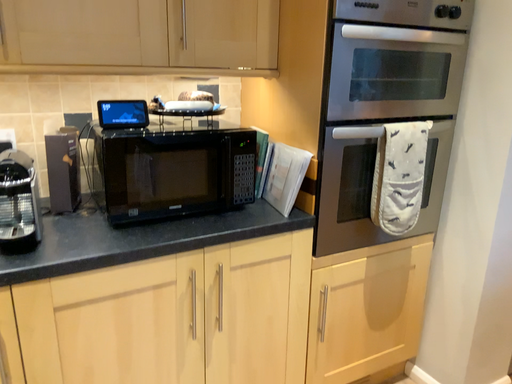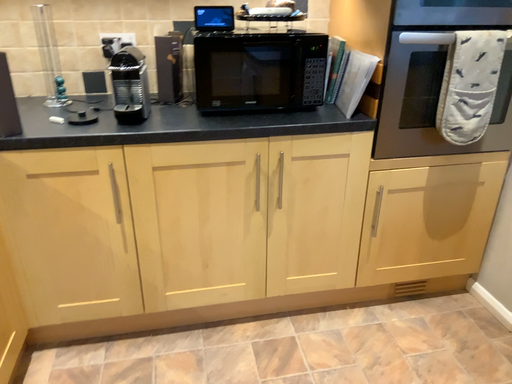
Question: How did the camera likely rotate when shooting the video?

Choices:
 (A) rotated left
 (B) rotated right

Answer: (A)